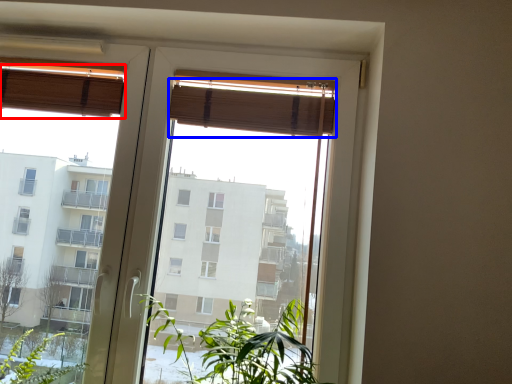
Question: Which object is further to the camera taking this photo, curtain (highlighted by a red box) or curtain (highlighted by a blue box)?

Choices:
 (A) curtain
 (B) curtain

Answer: (A)